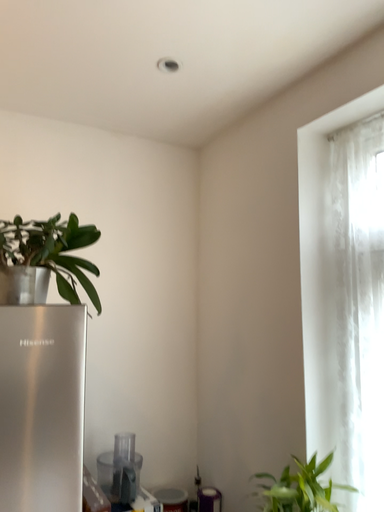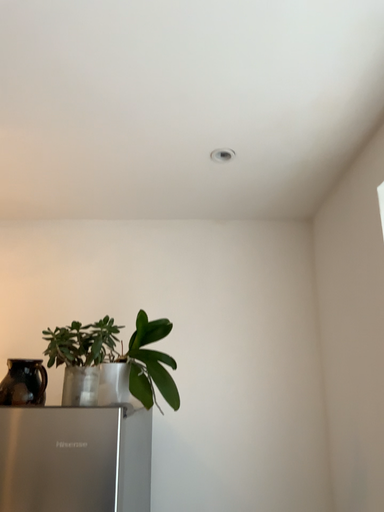
Question: Which way did the camera rotate in the video?

Choices:
 (A) rotated left
 (B) rotated right

Answer: (A)